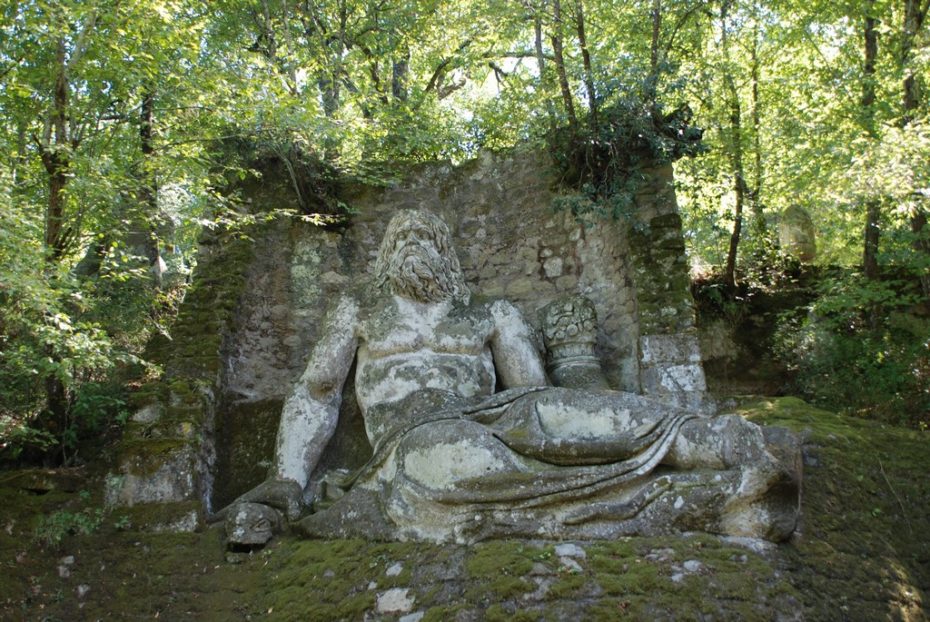
This screenshot has width=930, height=622. Find the location of `statue`. statue is located at coordinates (422, 322).